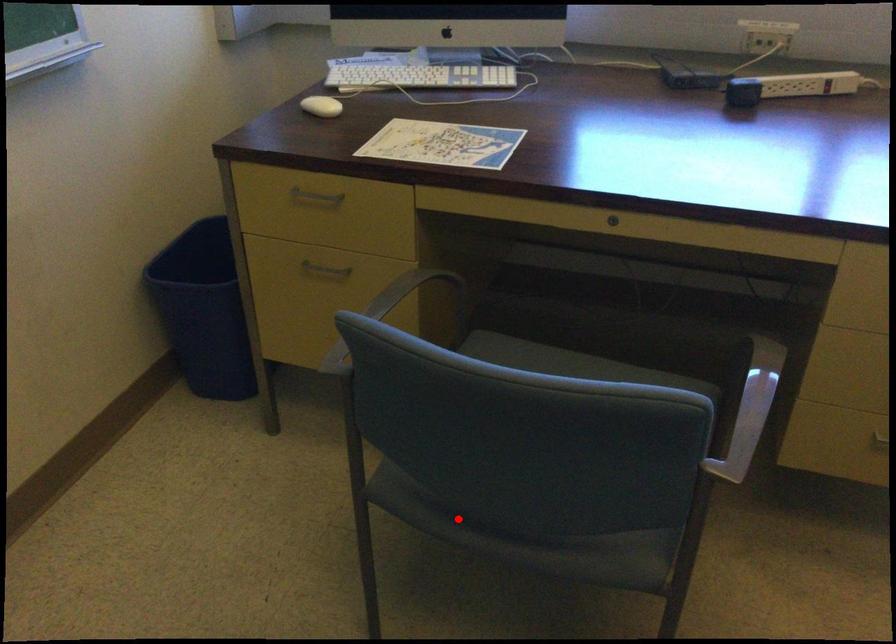
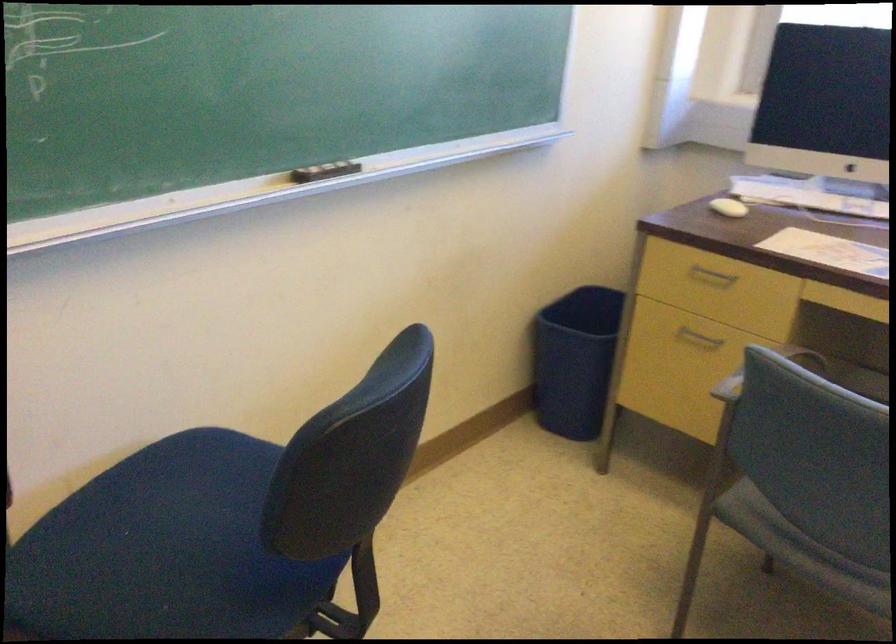
In the second image, find the point that corresponds to the highlighted location in the first image.

(800, 549)